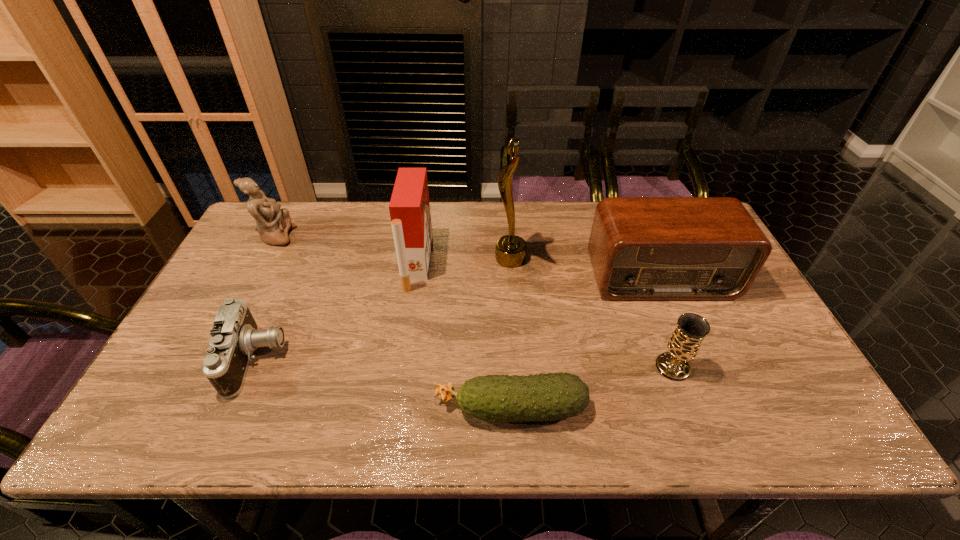
Locate an element on the screen. This screenshot has width=960, height=540. cigarette case that is positioned at the far edge is located at coordinates (409, 207).

Locate an element on the screen. The image size is (960, 540). figurine situated at the far edge is located at coordinates (273, 223).

Locate an element on the screen. object that is at the near edge is located at coordinates (541, 397).

In order to click on figurine that is at the left edge in this screenshot , I will do `click(273, 223)`.

This screenshot has width=960, height=540. In order to click on camera present at the left edge in this screenshot , I will do `click(235, 335)`.

Find the location of `object that is at the right edge`. object that is at the right edge is located at coordinates (641, 248).

Where is `object present at the far left corner`? Image resolution: width=960 pixels, height=540 pixels. object present at the far left corner is located at coordinates (273, 223).

Where is `free space at the far edge of the desktop`? The width and height of the screenshot is (960, 540). free space at the far edge of the desktop is located at coordinates (565, 207).

The width and height of the screenshot is (960, 540). Identify the location of vacant area at the left edge of the desktop. (208, 318).

Where is `free space at the right edge`? free space at the right edge is located at coordinates pos(777,387).